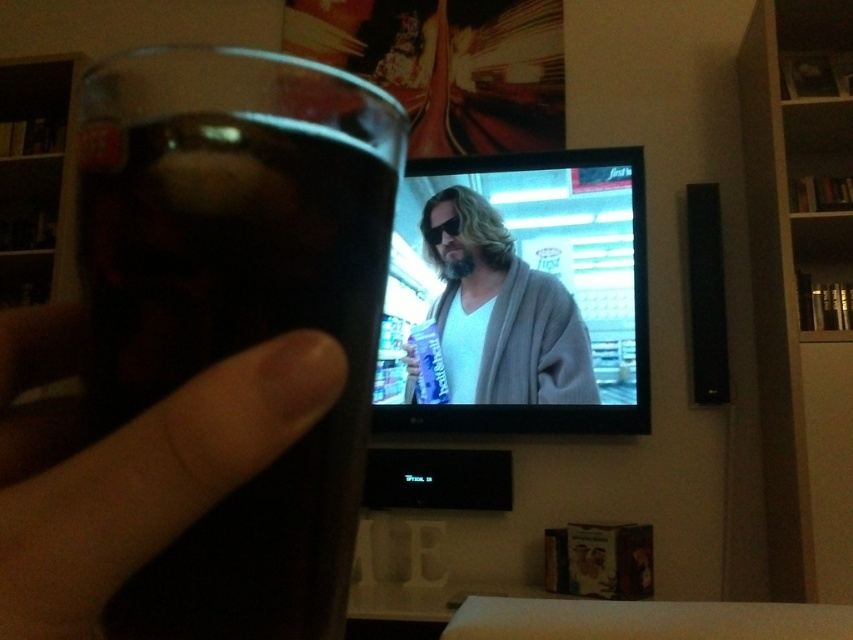
Does translucent glass at center have a greater height compared to matte gray bathrobe at center?

In fact, translucent glass at center may be shorter than matte gray bathrobe at center.

Locate an element on the screen. translucent glass at center is located at coordinates (236, 305).

Is translucent plastic finger at lower left thinner than matte gray bathrobe at center?

Correct, translucent plastic finger at lower left's width is less than matte gray bathrobe at center's.

Which is more to the right, translucent plastic finger at lower left or matte gray bathrobe at center?

matte gray bathrobe at center is more to the right.

Is point (149, 417) closer to viewer compared to point (461, 193)?

Yes.

The width and height of the screenshot is (853, 640). I want to click on translucent plastic finger at lower left, so click(128, 464).

Is point (259, 499) farther from camera compared to point (187, 493)?

Yes, point (259, 499) is farther from viewer.

The height and width of the screenshot is (640, 853). What do you see at coordinates (236, 305) in the screenshot?
I see `translucent glass at center` at bounding box center [236, 305].

Where is `translucent glass at center`? translucent glass at center is located at coordinates (236, 305).